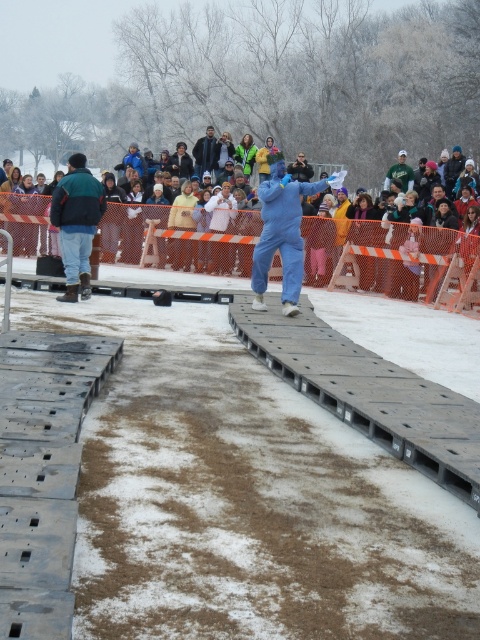
You are standing in the winter scene and want to take a photo of the jeans at left without including the multicolored fabric crowd at upper center in the frame. Which direction should you move to achieve this?

You should move closer to the jeans at left. Since the multicolored fabric crowd at upper center is closer to the viewer than the jeans at left, moving closer to the jeans will allow you to frame them without the crowd obstructing the view.

You are a photographer at the winter event. You want to capture a photo that includes both the multicolored fabric crowd at upper center and the blue matte jumpsuit at center. Which object should you focus on first to ensure both are in frame?

The multicolored fabric crowd at upper center is bigger than the blue matte jumpsuit at center, so you should focus on the multicolored fabric crowd at upper center first to ensure both fit in the frame.